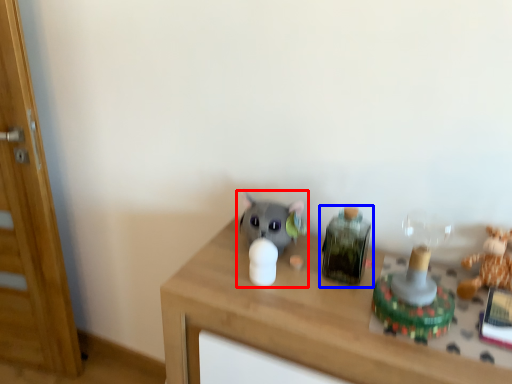
Question: Which object appears closest to the camera in this image, toy (highlighted by a red box) or toy (highlighted by a blue box)?

Choices:
 (A) toy
 (B) toy

Answer: (B)